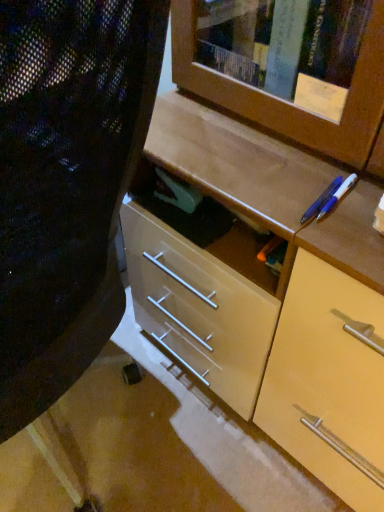
Measure the distance between blue glossy pen at upper right, placed as the 1th pencil when sorted from left to right, and camera.

24.45 inches.

Image resolution: width=384 pixels, height=512 pixels. What do you see at coordinates (337, 196) in the screenshot?
I see `blue plastic pen at upper right, which is the 2th pencil in left-to-right order` at bounding box center [337, 196].

The width and height of the screenshot is (384, 512). I want to click on matte black folding chair at center, so click(67, 183).

The height and width of the screenshot is (512, 384). Find the location of `blue glossy pen at upper right, placed as the 1th pencil when sorted from left to right`. blue glossy pen at upper right, placed as the 1th pencil when sorted from left to right is located at coordinates (321, 201).

Looking at this image, between blue glossy pen at upper right, placed as the 1th pencil when sorted from left to right, and matte black folding chair at center, which one has larger width?

Wider between the two is matte black folding chair at center.

Would you say blue glossy pen at upper right, placed as the 1th pencil when sorted from left to right, is to the left or to the right of matte black folding chair at center in the picture?

In the image, blue glossy pen at upper right, placed as the 1th pencil when sorted from left to right, appears on the right side of matte black folding chair at center.

The height and width of the screenshot is (512, 384). I want to click on folding chair in front of the blue glossy pen at upper right, which is the second pencil from right to left, so click(x=67, y=183).

From the image's perspective, is blue glossy pen at upper right, placed as the 1th pencil when sorted from left to right, below matte black folding chair at center?

No, from the image's perspective, blue glossy pen at upper right, placed as the 1th pencil when sorted from left to right, is not beneath matte black folding chair at center.

Consider the image. What's the angular difference between matte black folding chair at center and blue glossy pen at upper right, which is the second pencil from right to left,'s facing directions?

93.9 degrees separate the facing orientations of matte black folding chair at center and blue glossy pen at upper right, which is the second pencil from right to left.

Is the position of matte black folding chair at center less distant than that of blue glossy pen at upper right, placed as the 1th pencil when sorted from left to right?

Yes, it is in front of blue glossy pen at upper right, placed as the 1th pencil when sorted from left to right.

Who is bigger, matte black folding chair at center or blue glossy pen at upper right, placed as the 1th pencil when sorted from left to right?

matte black folding chair at center is bigger.

From the image's perspective, is matte black folding chair at center located above or below blue glossy pen at upper right, placed as the 1th pencil when sorted from left to right?

From the image's perspective, matte black folding chair at center appears below blue glossy pen at upper right, placed as the 1th pencil when sorted from left to right.

Is blue plastic pen at upper right, the first pencil in the right-to-left sequence, oriented towards blue glossy pen at upper right, placed as the 1th pencil when sorted from left to right?

No, blue plastic pen at upper right, the first pencil in the right-to-left sequence, is not turned towards blue glossy pen at upper right, placed as the 1th pencil when sorted from left to right.

Looking at this image, from a real-world perspective, is blue plastic pen at upper right, which is the 2th pencil in left-to-right order, physically located above or below blue glossy pen at upper right, placed as the 1th pencil when sorted from left to right?

blue plastic pen at upper right, which is the 2th pencil in left-to-right order, is situated lower than blue glossy pen at upper right, placed as the 1th pencil when sorted from left to right, in the real world.

Does blue plastic pen at upper right, the first pencil in the right-to-left sequence, have a lesser height compared to blue glossy pen at upper right, placed as the 1th pencil when sorted from left to right?

No, blue plastic pen at upper right, the first pencil in the right-to-left sequence, is not shorter than blue glossy pen at upper right, placed as the 1th pencil when sorted from left to right.

From the image's perspective, does blue plastic pen at upper right, which is the 2th pencil in left-to-right order, appear higher than blue glossy pen at upper right, placed as the 1th pencil when sorted from left to right?

Actually, blue plastic pen at upper right, which is the 2th pencil in left-to-right order, appears below blue glossy pen at upper right, placed as the 1th pencil when sorted from left to right, in the image.

Which object is wider, blue plastic pen at upper right, which is the 2th pencil in left-to-right order, or matte black folding chair at center?

With larger width is matte black folding chair at center.

Is blue plastic pen at upper right, which is the 2th pencil in left-to-right order, beside matte black folding chair at center?

No, blue plastic pen at upper right, which is the 2th pencil in left-to-right order, is not beside matte black folding chair at center.

From a real-world perspective, is blue plastic pen at upper right, the first pencil in the right-to-left sequence, positioned above or below matte black folding chair at center?

In terms of real-world spatial position, blue plastic pen at upper right, the first pencil in the right-to-left sequence, is above matte black folding chair at center.

From the matte black folding chair at center, count 2nd pencils backward and point to it. Please provide its 2D coordinates.

[(337, 196)]

Is blue plastic pen at upper right, which is the 2th pencil in left-to-right order, at the back of matte black folding chair at center?

No, matte black folding chair at center is not facing away from blue plastic pen at upper right, which is the 2th pencil in left-to-right order.

From a real-world perspective, is matte black folding chair at center on top of blue plastic pen at upper right, which is the 2th pencil in left-to-right order?

No.

Consider the image. Measure the distance between matte black folding chair at center and blue plastic pen at upper right, the first pencil in the right-to-left sequence.

16.76 inches.

Measure the distance from blue glossy pen at upper right, which is the second pencil from right to left, to blue plastic pen at upper right, the first pencil in the right-to-left sequence.

blue glossy pen at upper right, which is the second pencil from right to left, and blue plastic pen at upper right, the first pencil in the right-to-left sequence, are 0.48 inches apart from each other.

Is blue glossy pen at upper right, which is the second pencil from right to left, oriented away from blue plastic pen at upper right, the first pencil in the right-to-left sequence?

No, blue plastic pen at upper right, the first pencil in the right-to-left sequence, is not at the back of blue glossy pen at upper right, which is the second pencil from right to left.

Considering the sizes of objects blue glossy pen at upper right, placed as the 1th pencil when sorted from left to right, and blue plastic pen at upper right, the first pencil in the right-to-left sequence, in the image provided, who is wider, blue glossy pen at upper right, placed as the 1th pencil when sorted from left to right, or blue plastic pen at upper right, the first pencil in the right-to-left sequence,?

Wider between the two is blue glossy pen at upper right, placed as the 1th pencil when sorted from left to right.

How many degrees apart are the facing directions of blue glossy pen at upper right, placed as the 1th pencil when sorted from left to right, and blue plastic pen at upper right, the first pencil in the right-to-left sequence?

There is a 0.687-degree angle between the facing directions of blue glossy pen at upper right, placed as the 1th pencil when sorted from left to right, and blue plastic pen at upper right, the first pencil in the right-to-left sequence.

Identify the location of folding chair below the blue glossy pen at upper right, which is the second pencil from right to left (from a real-world perspective). The height and width of the screenshot is (512, 384). pos(67,183).

Where is `the 1st pencil counting from the right of the matte black folding chair at center`? The height and width of the screenshot is (512, 384). the 1st pencil counting from the right of the matte black folding chair at center is located at coordinates (321, 201).

When comparing their distances from matte black folding chair at center, does blue glossy pen at upper right, which is the second pencil from right to left, or blue plastic pen at upper right, which is the 2th pencil in left-to-right order, seem closer?

blue glossy pen at upper right, which is the second pencil from right to left, is positioned closer to the anchor matte black folding chair at center.

When comparing their distances from blue plastic pen at upper right, which is the 2th pencil in left-to-right order, does matte black folding chair at center or blue glossy pen at upper right, placed as the 1th pencil when sorted from left to right, seem further?

Among the two, matte black folding chair at center is located further to blue plastic pen at upper right, which is the 2th pencil in left-to-right order.

Looking at the image, which one is located closer to matte black folding chair at center, blue plastic pen at upper right, the first pencil in the right-to-left sequence, or blue glossy pen at upper right, which is the second pencil from right to left?

blue glossy pen at upper right, which is the second pencil from right to left, is positioned closer to the anchor matte black folding chair at center.

Looking at the image, which one is located closer to blue glossy pen at upper right, placed as the 1th pencil when sorted from left to right, blue plastic pen at upper right, which is the 2th pencil in left-to-right order, or matte black folding chair at center?

blue plastic pen at upper right, which is the 2th pencil in left-to-right order.

Which object lies nearer to the anchor point blue plastic pen at upper right, which is the 2th pencil in left-to-right order, blue glossy pen at upper right, placed as the 1th pencil when sorted from left to right, or matte black folding chair at center?

blue glossy pen at upper right, placed as the 1th pencil when sorted from left to right, lies closer to blue plastic pen at upper right, which is the 2th pencil in left-to-right order, than the other object.

Estimate the real-world distances between objects in this image. Which object is further from blue glossy pen at upper right, which is the second pencil from right to left, matte black folding chair at center or blue plastic pen at upper right, which is the 2th pencil in left-to-right order?

Based on the image, matte black folding chair at center appears to be further to blue glossy pen at upper right, which is the second pencil from right to left.

Locate an element on the screen. pencil located between matte black folding chair at center and blue plastic pen at upper right, the first pencil in the right-to-left sequence, in the left-right direction is located at coordinates (321, 201).